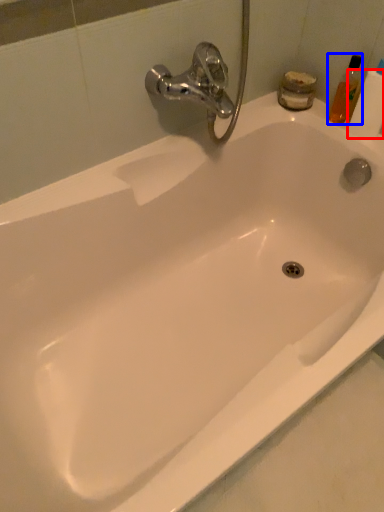
Question: Which object appears farthest to the camera in this image, toilet paper (highlighted by a red box) or toiletry (highlighted by a blue box)?

Choices:
 (A) toilet paper
 (B) toiletry

Answer: (B)